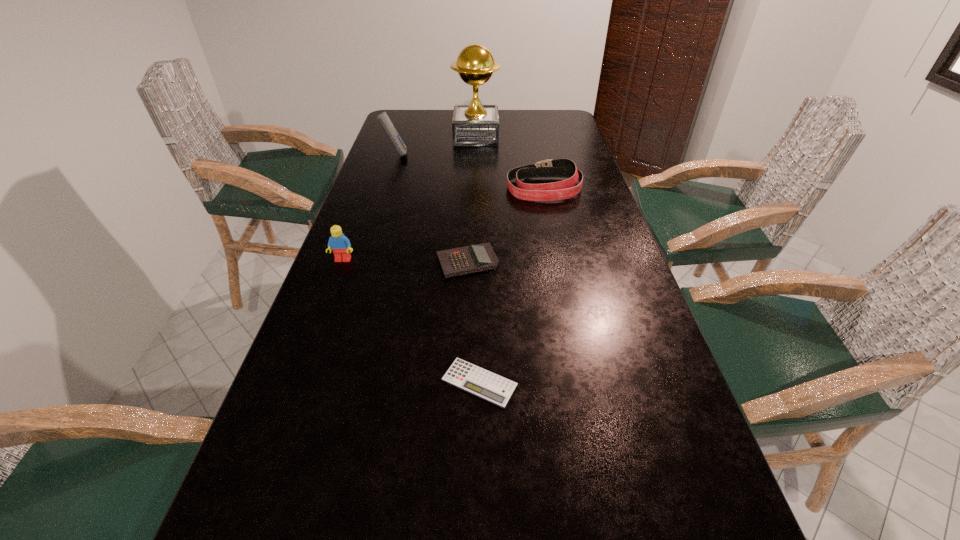
Image resolution: width=960 pixels, height=540 pixels. What are the coordinates of `the shortest object` in the screenshot? It's located at (473, 379).

The height and width of the screenshot is (540, 960). What are the coordinates of `vacant area situated on the front-facing side of the tallest object` in the screenshot? It's located at point(549,137).

Identify the location of free space located on the front-facing side of the leftmost calculator. (444, 155).

Where is `blank area located on the face of the Lego`? The width and height of the screenshot is (960, 540). blank area located on the face of the Lego is located at coordinates (322, 318).

Identify the location of free space located on the back of the fourth tallest object. Image resolution: width=960 pixels, height=540 pixels. (534, 140).

This screenshot has height=540, width=960. In order to click on free space located on the back of the fifth tallest object in this screenshot , I will do `click(468, 217)`.

Locate an element on the screen. The image size is (960, 540). vacant space located 0.210m on the back of the shortest object is located at coordinates (480, 288).

The height and width of the screenshot is (540, 960). Find the location of `object present at the far edge`. object present at the far edge is located at coordinates (473, 125).

The image size is (960, 540). I want to click on calculator present at the left edge, so click(383, 118).

Locate an element on the screen. Image resolution: width=960 pixels, height=540 pixels. Lego at the left edge is located at coordinates (339, 243).